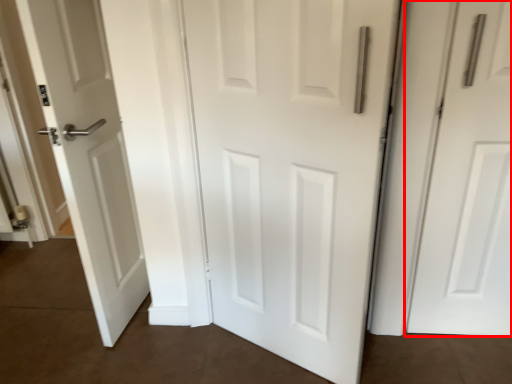
Question: From the image's perspective, where is door (annotated by the red box) located in relation to door in the image?

Choices:
 (A) below
 (B) above

Answer: (B)